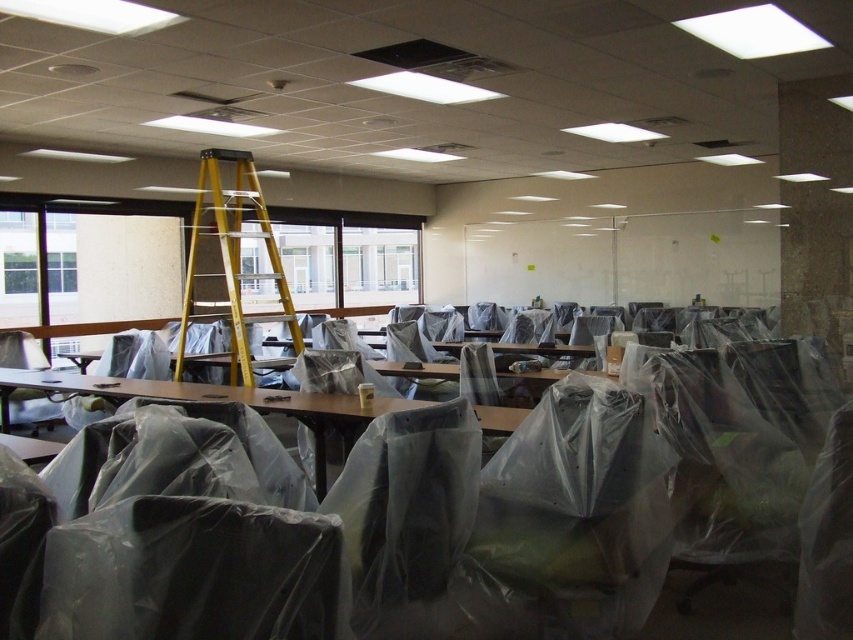
Does yellow fiberglass ladder at upper center appear over clear plastic table at center?

Correct, yellow fiberglass ladder at upper center is located above clear plastic table at center.

The width and height of the screenshot is (853, 640). Find the location of `yellow fiberglass ladder at upper center`. yellow fiberglass ladder at upper center is located at coordinates (229, 260).

Identify the location of yellow fiberglass ladder at upper center. The image size is (853, 640). (229, 260).

Can you confirm if yellow fiberglass ladder at upper center is taller than clear plastic chair at lower left?

Correct, yellow fiberglass ladder at upper center is much taller as clear plastic chair at lower left.

Between point (190, 317) and point (18, 349), which one is positioned in front?

Point (190, 317) is in front.

Who is more distant from viewer, (225,282) or (28,420)?

Positioned behind is point (225,282).

This screenshot has width=853, height=640. Find the location of `yellow fiberglass ladder at upper center`. yellow fiberglass ladder at upper center is located at coordinates (229, 260).

Can you confirm if clear plastic table at center is positioned above clear plastic chair at lower left?

Indeed, clear plastic table at center is positioned over clear plastic chair at lower left.

You are a GUI agent. You are given a task and a screenshot of the screen. Output one action in this format:
    pyautogui.click(x=<x>, y=<y>)
    Task: Click on the clear plastic table at center
    The height and width of the screenshot is (640, 853).
    Given the screenshot: What is the action you would take?
    pyautogui.click(x=222, y=401)